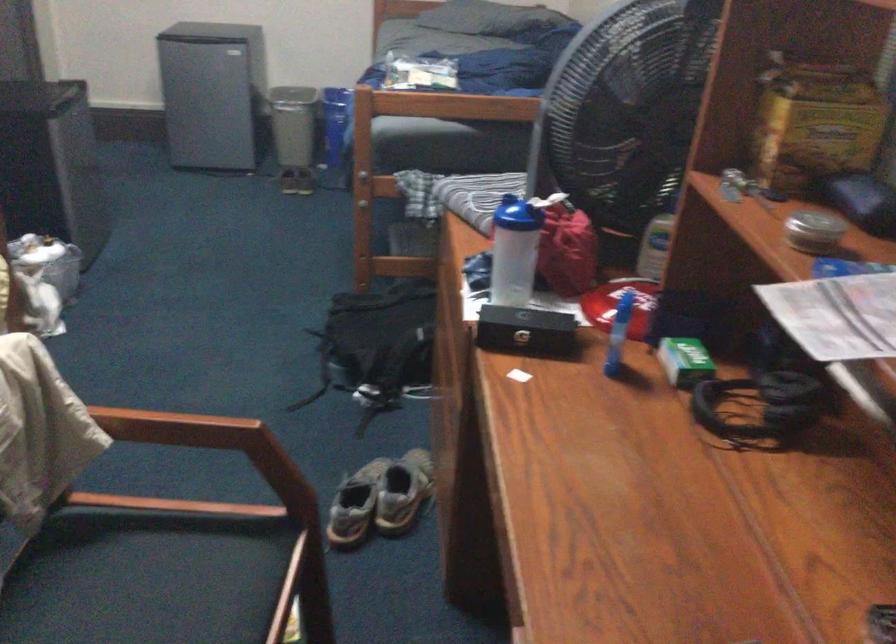
Describe the element at coordinates (293, 124) in the screenshot. I see `the gray trash can` at that location.